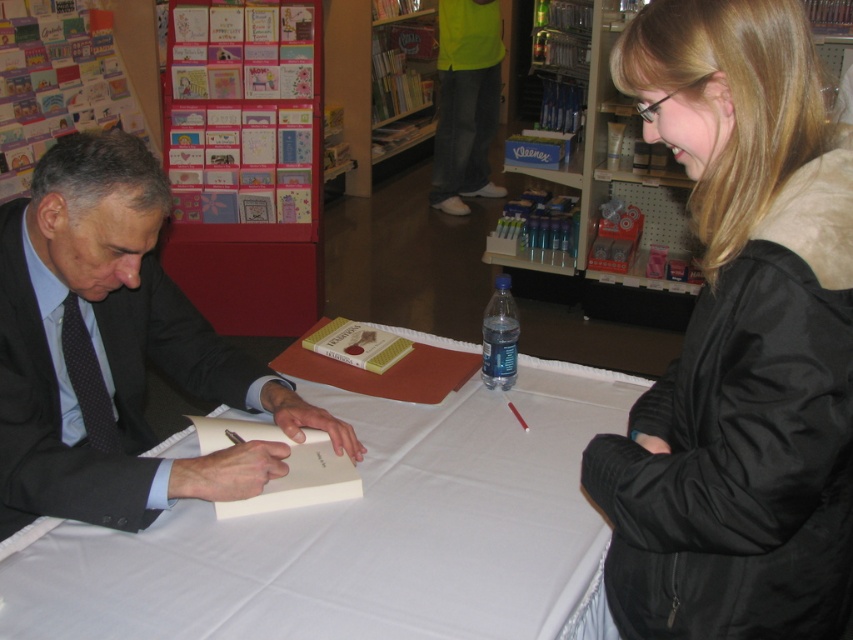
Between point (144, 323) and point (196, 196), which one is positioned in front?

Point (144, 323) is more forward.

Does dark gray suit at left have a lesser width compared to cardboard greeting cards at upper left?

Correct, dark gray suit at left's width is less than cardboard greeting cards at upper left's.

Is point (138, 500) farther from viewer compared to point (238, 173)?

No, (138, 500) is closer to viewer.

Find the location of a particular element. dark gray suit at left is located at coordinates pos(114,349).

Can you confirm if white cloth table at center is taller than cardboard greeting cards at upper left?

No.

Does white cloth table at center have a smaller size compared to cardboard greeting cards at upper left?

No.

Is point (172, 589) behind point (252, 148)?

No, it is not.

You are a GUI agent. You are given a task and a screenshot of the screen. Output one action in this format:
    pyautogui.click(x=<x>, y=<y>)
    Task: Click on the white cloth table at center
    The height and width of the screenshot is (640, 853).
    Given the screenshot: What is the action you would take?
    pyautogui.click(x=360, y=532)

In the scene shown: Does white cloth table at center have a greater height compared to dark gray suit at left?

In fact, white cloth table at center may be shorter than dark gray suit at left.

Does point (59, 612) lie behind point (10, 525)?

No.

Where is `white cloth table at center`? This screenshot has height=640, width=853. white cloth table at center is located at coordinates (360, 532).